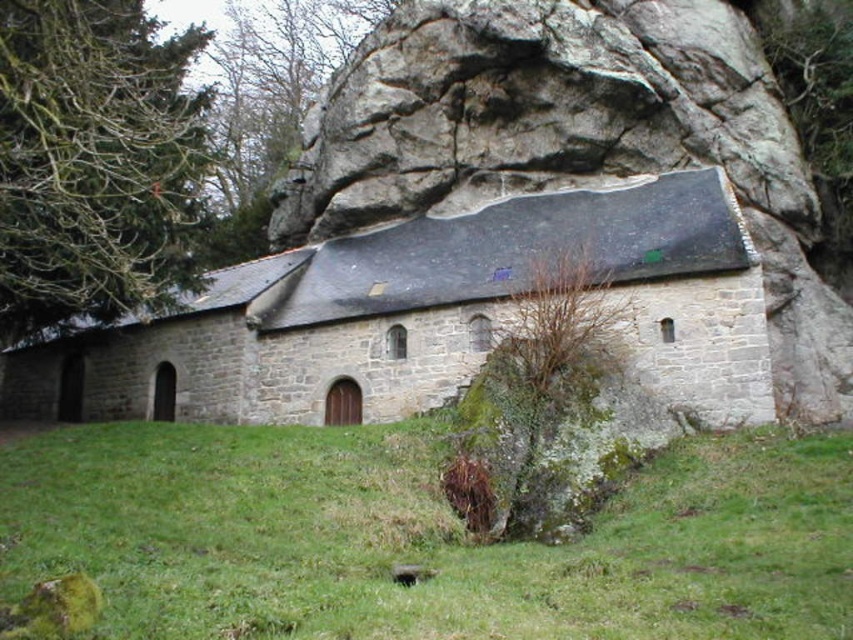
Question: Considering the real-world distances, which object is closest to the green grass at lower center?

Choices:
 (A) green leafy tree at upper left
 (B) gray stone church at center

Answer: (B)

Question: Can you confirm if green grass at lower center is thinner than green leafy tree at upper left?

Choices:
 (A) yes
 (B) no

Answer: (B)

Question: Can you confirm if green grass at lower center is smaller than gray stone church at center?

Choices:
 (A) yes
 (B) no

Answer: (A)

Question: Can you confirm if green grass at lower center is positioned to the right of green leafy tree at upper left?

Choices:
 (A) yes
 (B) no

Answer: (A)

Question: Which object appears closest to the camera in this image?

Choices:
 (A) gray stone church at center
 (B) green leafy tree at upper left
 (C) green grass at lower center

Answer: (C)

Question: Which point is farther to the camera?

Choices:
 (A) green leafy tree at upper left
 (B) green grass at lower center
 (C) gray stone church at center

Answer: (C)